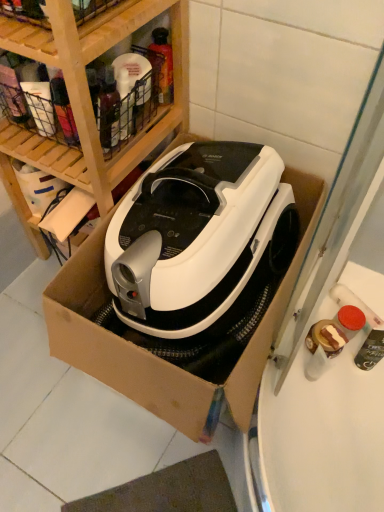
Question: Is white cardboard box at center thinner than translucent plastic spray bottle at upper center?

Choices:
 (A) no
 (B) yes

Answer: (A)

Question: From a real-world perspective, is white cardboard box at center positioned over translucent plastic spray bottle at upper center based on gravity?

Choices:
 (A) no
 (B) yes

Answer: (A)

Question: Is white cardboard box at center far from translucent plastic spray bottle at upper center?

Choices:
 (A) no
 (B) yes

Answer: (A)

Question: Is the depth of white cardboard box at center greater than that of translucent plastic spray bottle at upper center?

Choices:
 (A) no
 (B) yes

Answer: (A)

Question: Is white cardboard box at center closer to camera compared to translucent plastic spray bottle at upper center?

Choices:
 (A) yes
 (B) no

Answer: (A)

Question: Is point (97, 189) closer or farther from the camera than point (49, 346)?

Choices:
 (A) farther
 (B) closer

Answer: (B)

Question: Considering the relative positions of wooden at upper left and white cardboard box at center in the image provided, is wooden at upper left to the left or to the right of white cardboard box at center?

Choices:
 (A) right
 (B) left

Answer: (B)

Question: Considering the positions of wooden at upper left and white cardboard box at center in the image, is wooden at upper left wider or thinner than white cardboard box at center?

Choices:
 (A) thin
 (B) wide

Answer: (A)

Question: From the image's perspective, is wooden at upper left located above or below white cardboard box at center?

Choices:
 (A) below
 (B) above

Answer: (B)

Question: Considering the positions of point pos(283,286) and point pos(155,71), is point pos(283,286) closer or farther from the camera than point pos(155,71)?

Choices:
 (A) closer
 (B) farther

Answer: (A)

Question: In the image, is white cardboard box at center on the left side or the right side of translucent plastic spray bottle at upper center?

Choices:
 (A) left
 (B) right

Answer: (B)

Question: Considering their positions, is white cardboard box at center located in front of or behind translucent plastic spray bottle at upper center?

Choices:
 (A) behind
 (B) front

Answer: (B)

Question: Is white cardboard box at center bigger or smaller than translucent plastic spray bottle at upper center?

Choices:
 (A) big
 (B) small

Answer: (A)

Question: Do you think white cardboard box at center is within wooden at upper left, or outside of it?

Choices:
 (A) outside
 (B) inside

Answer: (A)

Question: Considering the positions of point (66, 322) and point (36, 58), is point (66, 322) closer or farther from the camera than point (36, 58)?

Choices:
 (A) farther
 (B) closer

Answer: (A)